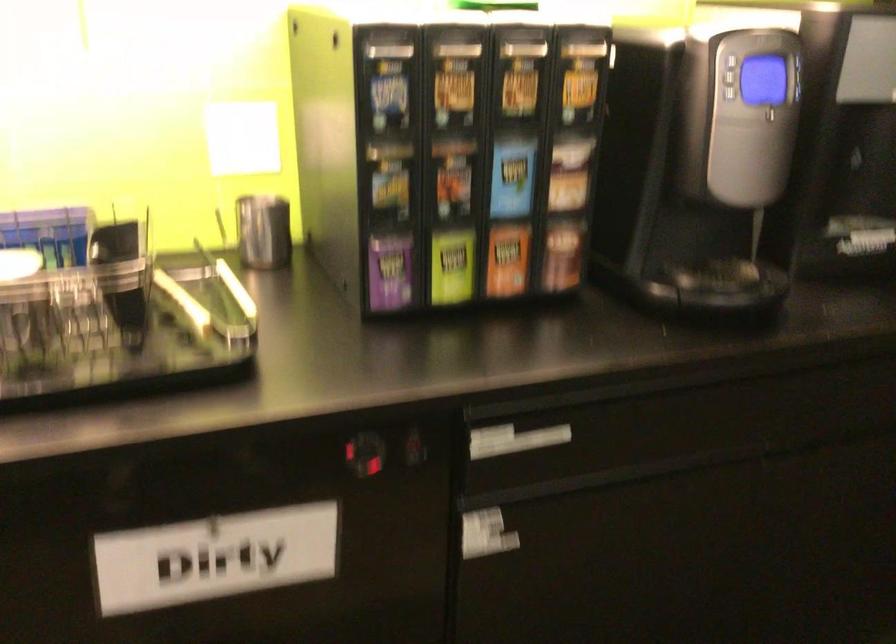
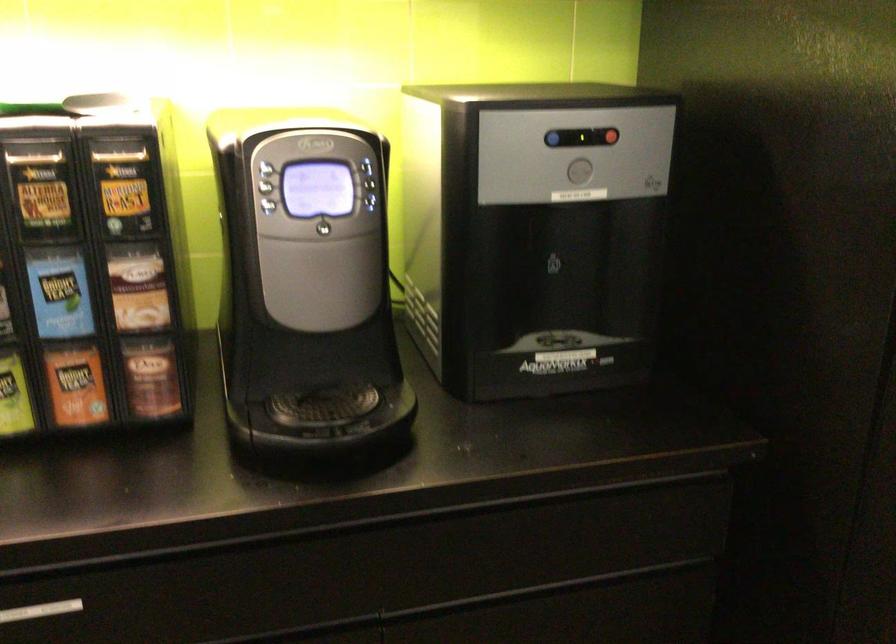
Where in the second image is the point corresponding to point 519,80 from the first image?

(41, 191)